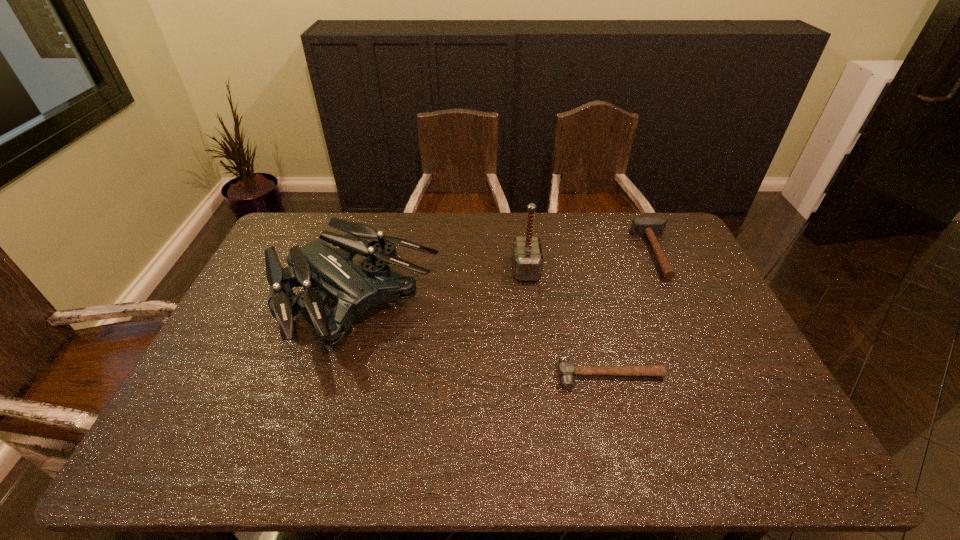
The width and height of the screenshot is (960, 540). I want to click on empty space between the second hammer from left to right and the tallest hammer, so click(568, 322).

Locate an element on the screen. Image resolution: width=960 pixels, height=540 pixels. empty space that is in between the third tallest object and the second tallest object is located at coordinates (506, 280).

Find the location of `the closest object to the tallest object`. the closest object to the tallest object is located at coordinates (327, 263).

Find the location of a particular element. The image size is (960, 540). object that stands as the closest to the nearest hammer is located at coordinates (527, 256).

Select which hammer appears as the third closest to the second tallest object. Please provide its 2D coordinates. Your answer should be formatted as a tuple, i.e. [(x, y)], where the tuple contains the x and y coordinates of a point satisfying the conditions above.

[(651, 227)]

Where is `hammer that can be found as the second closest to the drone`? hammer that can be found as the second closest to the drone is located at coordinates click(566, 369).

The image size is (960, 540). In order to click on vacant space that satisfies the following two spatial constraints: 1. on the striking surface of the second shortest hammer; 2. on the striking face of the third object from left to right in this screenshot , I will do `click(716, 375)`.

Where is `free space in the image that satisfies the following two spatial constraints: 1. on the striking surface of the rightmost object; 2. on the front side of the leftmost hammer`? free space in the image that satisfies the following two spatial constraints: 1. on the striking surface of the rightmost object; 2. on the front side of the leftmost hammer is located at coordinates (665, 269).

Identify the location of blank space that satisfies the following two spatial constraints: 1. on the striking surface of the rightmost object; 2. on the striking face of the nearest hammer. The height and width of the screenshot is (540, 960). (716, 375).

Where is `vacant area that satisfies the following two spatial constraints: 1. on the striking surface of the rightmost hammer; 2. on the striking face of the second object from right to left`? vacant area that satisfies the following two spatial constraints: 1. on the striking surface of the rightmost hammer; 2. on the striking face of the second object from right to left is located at coordinates (716, 375).